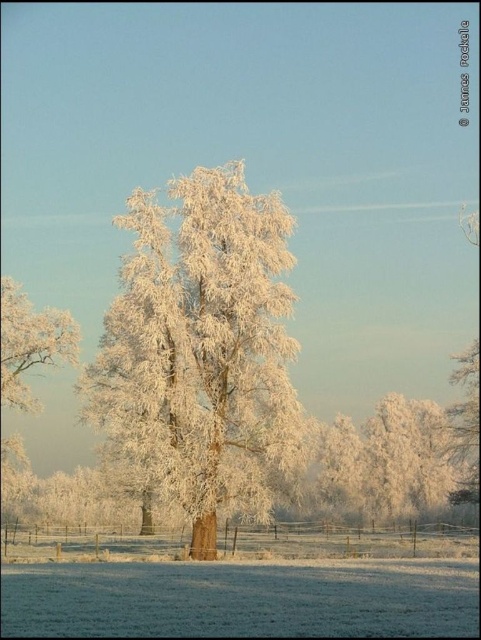
Question: Does frosted white tree at center come in front of frosty white tree at left?

Choices:
 (A) no
 (B) yes

Answer: (B)

Question: Does frosted white tree at center have a larger size compared to frosty white tree at left?

Choices:
 (A) yes
 (B) no

Answer: (A)

Question: Considering the relative positions of frosted white tree at center and frosty white tree at left in the image provided, where is frosted white tree at center located with respect to frosty white tree at left?

Choices:
 (A) right
 (B) left

Answer: (A)

Question: Among these points, which one is farthest from the camera?

Choices:
 (A) (48, 358)
 (B) (128, 454)

Answer: (A)